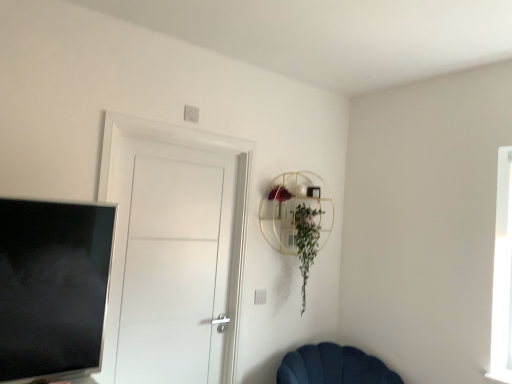
Question: Considering their positions, is white matte door at center located in front of or behind velvet dark blue chair at lower center?

Choices:
 (A) behind
 (B) front

Answer: (B)

Question: In terms of width, does white matte door at center look wider or thinner when compared to velvet dark blue chair at lower center?

Choices:
 (A) wide
 (B) thin

Answer: (B)

Question: Which of these objects is positioned closest to the white matte door at center?

Choices:
 (A) velvet dark blue chair at lower center
 (B) silver metallic tv at left
 (C) green leafy plant at upper center

Answer: (C)

Question: Based on their relative distances, which object is nearer to the white matte door at center?

Choices:
 (A) silver metallic tv at left
 (B) green leafy plant at upper center
 (C) velvet dark blue chair at lower center

Answer: (B)